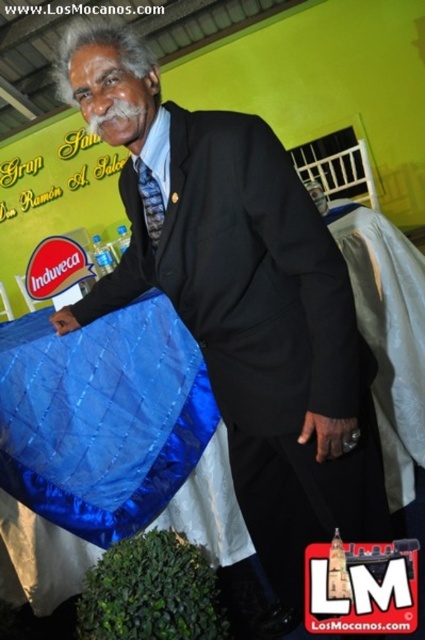
You are at an event and need to find the blue shiny bag at lower left. According to the image, where exactly is it located?

The blue shiny bag at lower left is located at point (110, 444).

You are organizing a small event and need to place items on a table. You have a blue shiny bag at lower left and a white fabric at right. Which item takes up more space on the table?

The white fabric at right takes up more space on the table because the blue shiny bag at lower left has a smaller size compared to it.

Consider the image. You are organizing a small event and need to place a 1.2 meter long banner between the blue shiny bag at lower left and the white fabric at right. Will the banner fit between them?

The blue shiny bag at lower left is shorter than the white fabric at right, but the distance between them isn not specified. Without knowing the exact spacing, it is impossible to determine if the banner will fit.